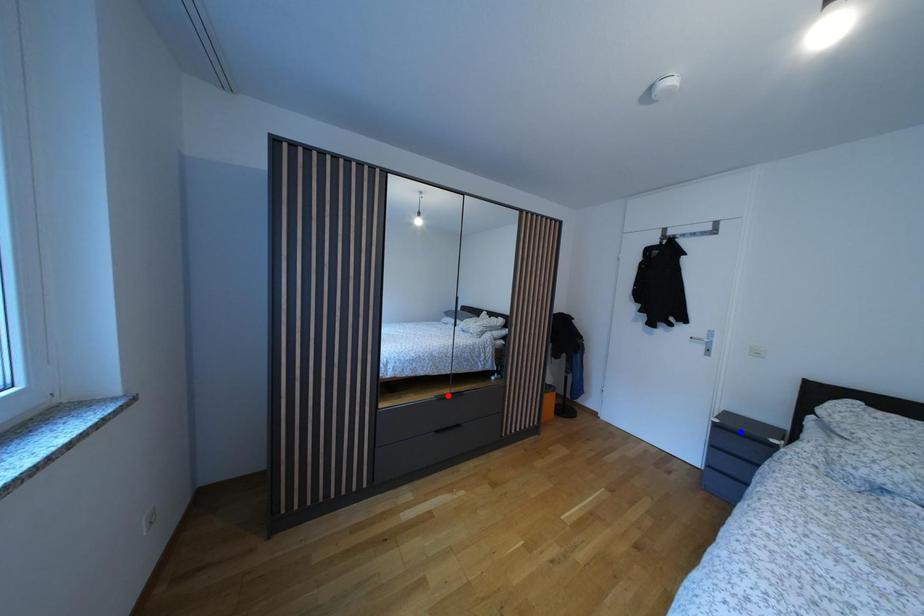
Question: Which of the two points in the image is closer to the camera?

Choices:
 (A) Blue point is closer.
 (B) Red point is closer.

Answer: (A)